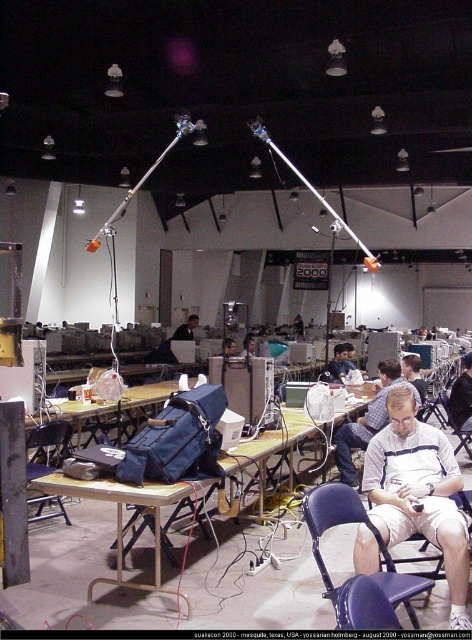
You are setting up for an event and need to place a 3ft wide laptop on the metallic silver table at center. Can the laptop fit on the table if the matte black chair at lower left is already placed on it?

The metallic silver table at center has a width larger than the matte black chair at lower left, so the laptop should fit as long as there is enough space remaining after placing the chair.

You are standing at the point labeled point (314, 532). You need to walk to the laptop on the table closest to the man. How far will you have to walk?

The distance between you and the laptop on the table closest to the man is 8.84 feet.